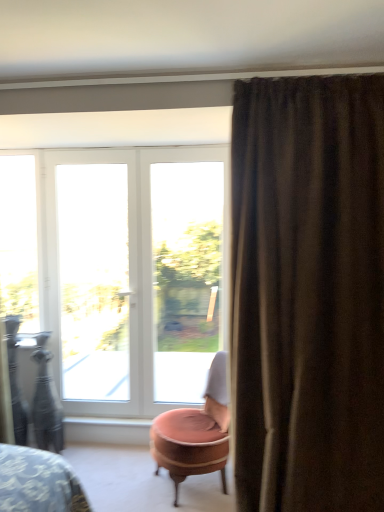
Where is `empty space that is ontop of white glass door at left, placed as the 2th window when sorted from right to left (from a real-world perspective)`? This screenshot has width=384, height=512. empty space that is ontop of white glass door at left, placed as the 2th window when sorted from right to left (from a real-world perspective) is located at coordinates (89, 152).